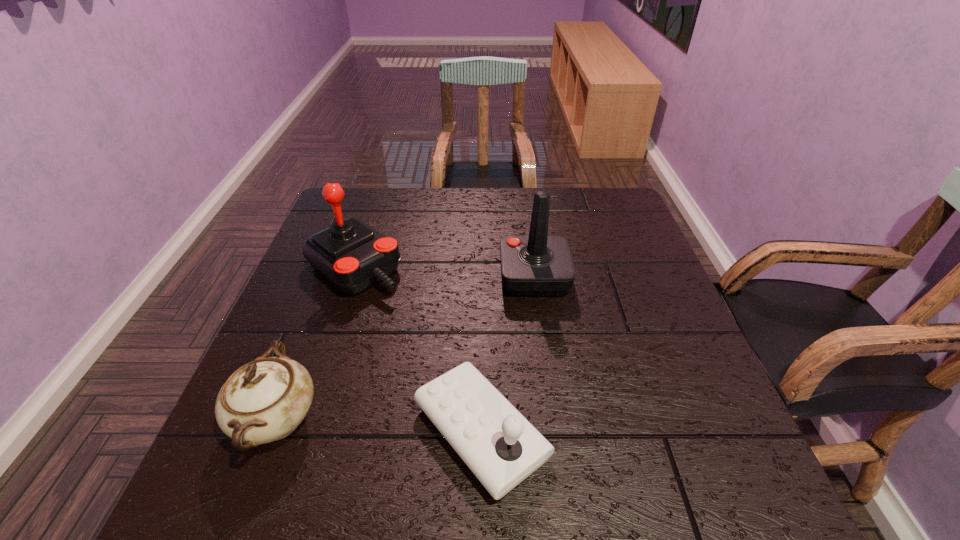
This screenshot has height=540, width=960. I want to click on chinaware that is at the left edge, so click(265, 400).

What are the coordinates of `object present at the near left corner` in the screenshot? It's located at (265, 400).

This screenshot has width=960, height=540. Find the location of `vacant space at the far edge of the desktop`. vacant space at the far edge of the desktop is located at coordinates (444, 229).

Locate an element on the screen. This screenshot has width=960, height=540. vacant space at the near edge of the desktop is located at coordinates pyautogui.click(x=365, y=492).

Identify the location of vacant area at the right edge. This screenshot has width=960, height=540. (702, 434).

I want to click on free region at the far left corner of the desktop, so click(348, 198).

The width and height of the screenshot is (960, 540). In the image, there is a desktop. Find the location of `free space at the far right corner`. free space at the far right corner is located at coordinates (x=599, y=222).

Locate an element on the screen. The height and width of the screenshot is (540, 960). vacant point located between the leftmost joystick and the third tallest object is located at coordinates (316, 343).

This screenshot has width=960, height=540. In order to click on blank region between the nearest joystick and the third tallest object in this screenshot , I will do `click(379, 426)`.

Identify the location of free point between the shortest joystick and the leftmost joystick. The image size is (960, 540). [x=418, y=349].